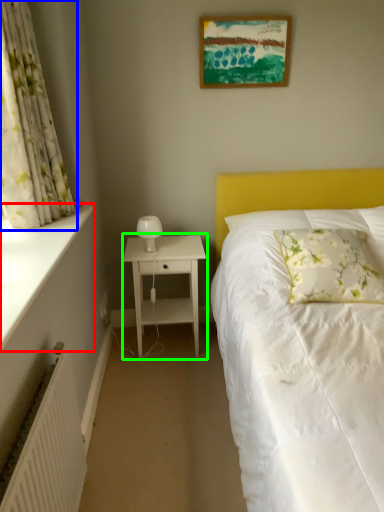
Question: Considering the real-world distances, which object is farthest from window sill (highlighted by a red box)? curtain (highlighted by a blue box) or nightstand (highlighted by a green box)?

Choices:
 (A) curtain
 (B) nightstand

Answer: (B)